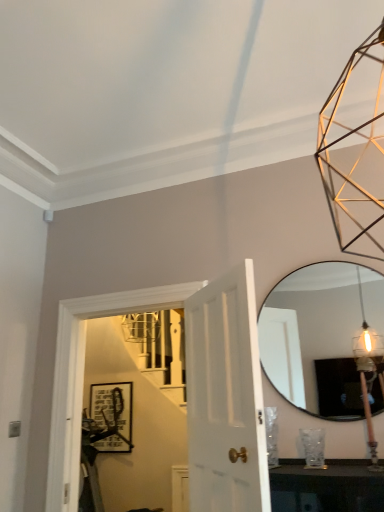
Question: From a real-world perspective, is matte glass mirror at right physically located above or below white glossy door at center?

Choices:
 (A) above
 (B) below

Answer: (A)

Question: Is matte glass mirror at right inside the boundaries of white glossy door at center, or outside?

Choices:
 (A) outside
 (B) inside

Answer: (A)

Question: Which of these objects is positioned closest to the white glossy door at center?

Choices:
 (A) black matte picture frame at center
 (B) matte glass mirror at right
 (C) wooden pole at right

Answer: (C)

Question: Estimate the real-world distances between objects in this image. Which object is farther from the black matte picture frame at center?

Choices:
 (A) wooden pole at right
 (B) white glossy door at center
 (C) matte glass mirror at right

Answer: (B)